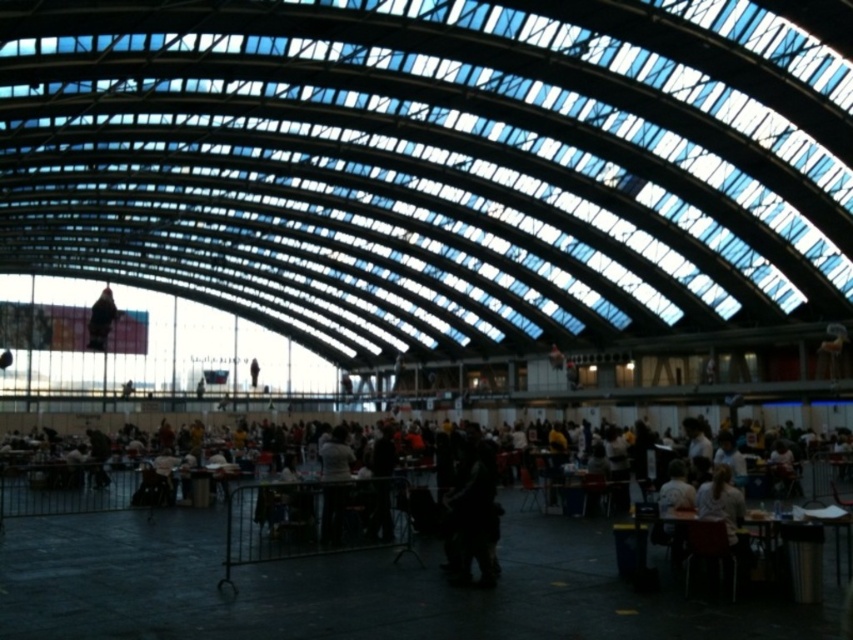
You are a photographer setting up a shoot in this modern building. You need to place a small tripod between the dark gray jacket at center and the dark fabric bag at center. Considering their sizes, which object should you position the tripod closer to to ensure it doesn

The dark gray jacket at center is larger in size than the dark fabric bag at center, so positioning the tripod closer to the dark fabric bag at center would provide more space around the larger jacket for the shoot.

You are a person carrying a dark fabric bag at center and want to place it on the wooden table at lower right. Considering their positions, can you easily reach the table from where you are standing?

The dark fabric bag at center is further to the viewer than wooden table at lower right, so you are closer to the table and can easily reach it.

You are a person standing at the entrance of the building and want to pick up your dark gray jacket at center and dark fabric bag at center. Which item should you pick up first if you want to retrieve the one that is closer to the ground?

The dark gray jacket at center is below dark fabric bag at center, so you should pick up the dark gray jacket at center first since it is closer to the ground.